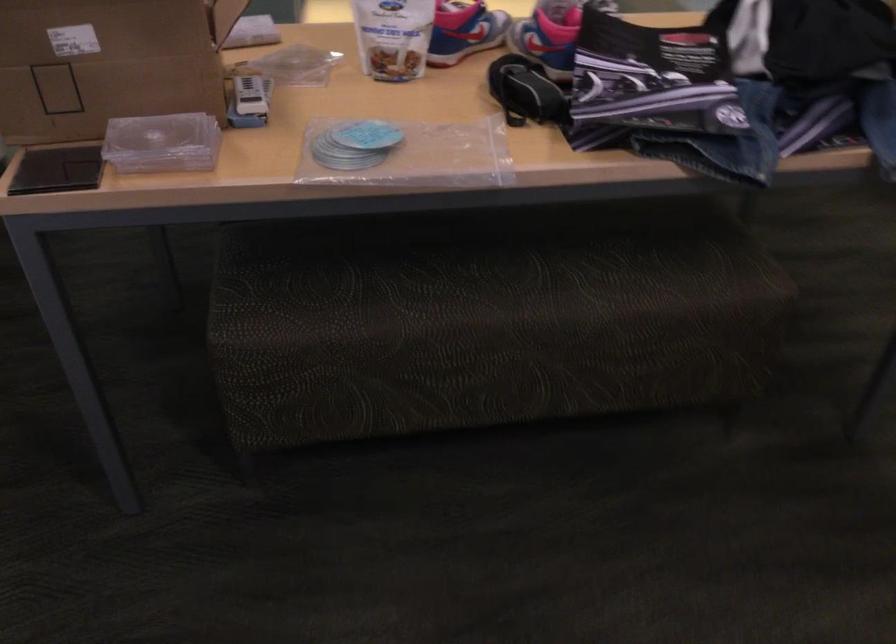
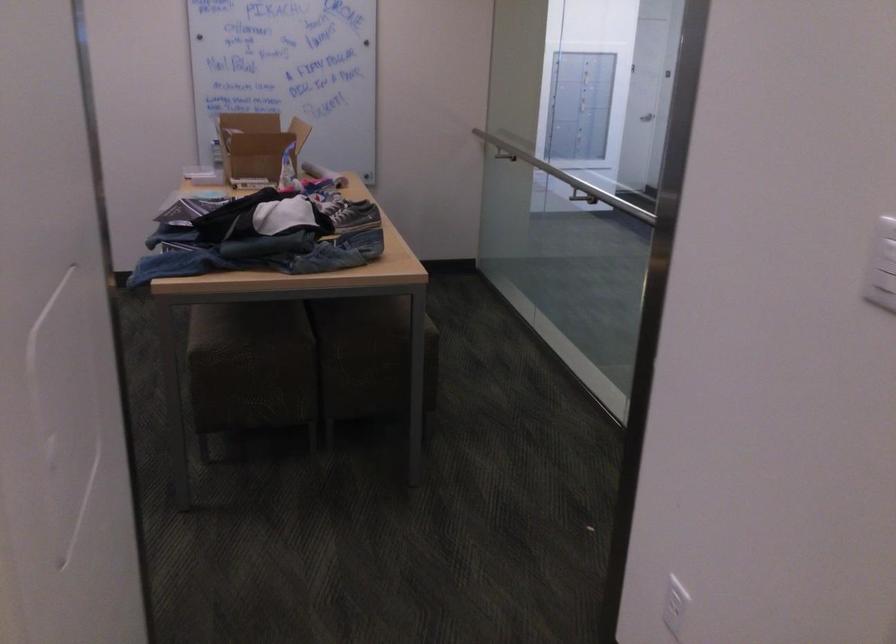
Question: I am providing you with two images of the same scene from different viewpoints. After the viewpoint changes to image2, which objects are now occluded?

Choices:
 (A) stool sitting surface
 (B) cardboard box
 (C) blue and pink sneaker
 (D) black network plug

Answer: (C)